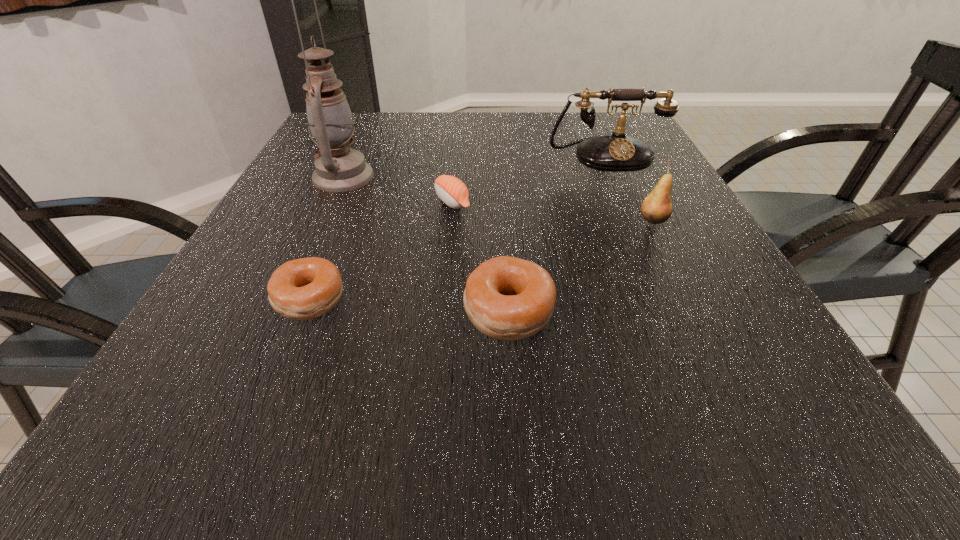
You are a GUI agent. You are given a task and a screenshot of the screen. Output one action in this format:
    pyautogui.click(x=<x>, y=<y>)
    Task: Click on the shorter bagel
    Image resolution: width=960 pixels, height=540 pixels.
    Given the screenshot: What is the action you would take?
    pyautogui.click(x=303, y=289)

Where is `the fourth tallest object`? The height and width of the screenshot is (540, 960). the fourth tallest object is located at coordinates (506, 298).

I want to click on the taller bagel, so click(506, 298).

Identify the location of telephone. (616, 153).

Image resolution: width=960 pixels, height=540 pixels. I want to click on sushi, so click(452, 191).

The image size is (960, 540). In order to click on the tallest object in this screenshot , I will do `click(339, 168)`.

In order to click on pear in this screenshot , I will do point(656,208).

Where is `blank space located 0.260m on the back of the shorter bagel`? The height and width of the screenshot is (540, 960). blank space located 0.260m on the back of the shorter bagel is located at coordinates (351, 198).

Image resolution: width=960 pixels, height=540 pixels. Identify the location of vacant space located 0.170m on the right of the right bagel. (657, 312).

What are the coordinates of `free region located on the dial of the second tallest object` in the screenshot? It's located at (644, 246).